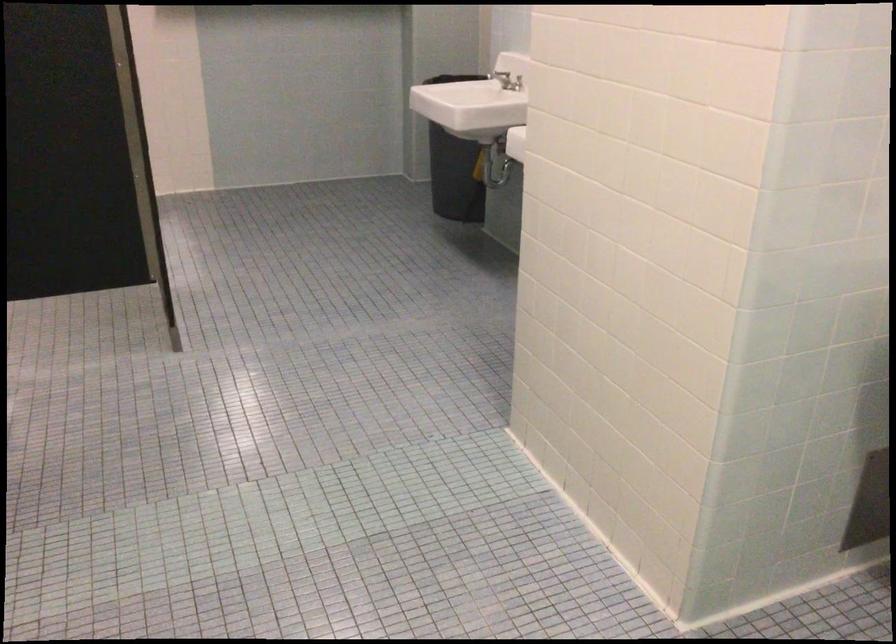
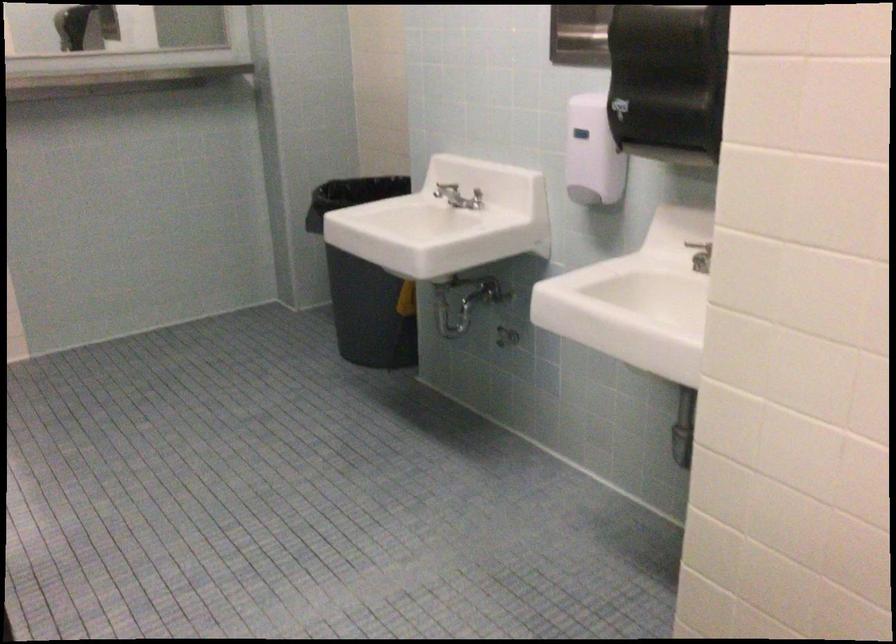
Which direction would the cameraman need to move to produce the second image?

The cameraman walked toward left, forward.